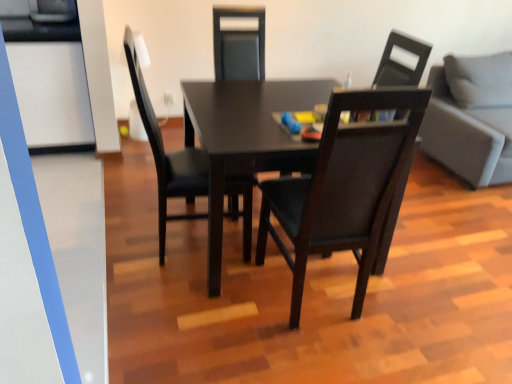
Find the location of `matte black chair at center, the third chair when ordered from left to right`. matte black chair at center, the third chair when ordered from left to right is located at coordinates (399, 63).

Describe the element at coordinates (167, 154) in the screenshot. I see `matte black chair at center, arranged as the first chair when viewed from the left` at that location.

This screenshot has height=384, width=512. What do you see at coordinates (343, 188) in the screenshot?
I see `matte black chair at center, which appears as the 2th chair when viewed from the right` at bounding box center [343, 188].

In order to click on gray fabric couch at right in this screenshot , I will do `click(471, 118)`.

Does gray fabric couch at right have a smaller size compared to matte black table at center?

No.

Image resolution: width=512 pixels, height=384 pixels. What are the coordinates of `studio couch behind the matte black table at center` in the screenshot? It's located at (471, 118).

How different are the orientations of gray fabric couch at right and matte black table at center in degrees?

gray fabric couch at right and matte black table at center are facing 90.5 degrees away from each other.

From the picture: Is gray fabric couch at right to the right of matte black table at center from the viewer's perspective?

Correct, you'll find gray fabric couch at right to the right of matte black table at center.

From a real-world perspective, is gray fabric couch at right under matte black chair at center, the third chair when ordered from left to right?

Yes, from a real-world perspective, gray fabric couch at right is below matte black chair at center, the third chair when ordered from left to right.

Could you measure the distance between gray fabric couch at right and matte black chair at center, the first chair in the right-to-left sequence?

gray fabric couch at right and matte black chair at center, the first chair in the right-to-left sequence, are 33.77 inches apart from each other.

Between gray fabric couch at right and matte black chair at center, the third chair when ordered from left to right, which one has larger size?

With larger size is gray fabric couch at right.

Between gray fabric couch at right and matte black chair at center, the first chair in the right-to-left sequence, which one appears on the right side from the viewer's perspective?

gray fabric couch at right.

Does matte black chair at center, which is the third chair from right to left, have a larger size compared to transparent glass door at left?

Indeed, matte black chair at center, which is the third chair from right to left, has a larger size compared to transparent glass door at left.

In the image, is matte black chair at center, which is the third chair from right to left, on the left side or the right side of transparent glass door at left?

Based on their positions, matte black chair at center, which is the third chair from right to left, is located to the right of transparent glass door at left.

Would you say matte black chair at center, which is the third chair from right to left, is outside transparent glass door at left?

That's correct, matte black chair at center, which is the third chair from right to left, is outside of transparent glass door at left.

In the scene shown: From a real-world perspective, is matte black chair at center, arranged as the first chair when viewed from the left, located beneath transparent glass door at left?

Indeed, from a real-world perspective, matte black chair at center, arranged as the first chair when viewed from the left, is positioned beneath transparent glass door at left.

Is matte black chair at center, the first chair in the right-to-left sequence, turned away from matte black chair at center, arranged as the first chair when viewed from the left?

matte black chair at center, the first chair in the right-to-left sequence, is not turned away from matte black chair at center, arranged as the first chair when viewed from the left.

Can you confirm if matte black chair at center, the third chair when ordered from left to right, is positioned to the right of matte black chair at center, which is the third chair from right to left?

Indeed, matte black chair at center, the third chair when ordered from left to right, is positioned on the right side of matte black chair at center, which is the third chair from right to left.

Which object is further away from the camera, matte black chair at center, the third chair when ordered from left to right, or matte black chair at center, arranged as the first chair when viewed from the left?

matte black chair at center, the third chair when ordered from left to right, is more distant.

Which is behind, point (409, 44) or point (256, 183)?

The point (409, 44) is behind.

Is the surface of gray fabric couch at right in direct contact with matte black chair at center, the 2th chair in the left-to-right sequence?

No, gray fabric couch at right is not next to matte black chair at center, the 2th chair in the left-to-right sequence.

Looking at this image, in terms of size, does gray fabric couch at right appear bigger or smaller than matte black chair at center, the 2th chair in the left-to-right sequence?

In the image, gray fabric couch at right appears to be larger than matte black chair at center, the 2th chair in the left-to-right sequence.

Considering the points (469, 135) and (302, 236), which point is in front, point (469, 135) or point (302, 236)?

The point (302, 236) is closer.

How different are the orientations of gray fabric couch at right and matte black chair at center, which appears as the 2th chair when viewed from the right, in degrees?

The angle between the facing direction of gray fabric couch at right and the facing direction of matte black chair at center, which appears as the 2th chair when viewed from the right, is 175 degrees.

Does matte black chair at center, the first chair in the right-to-left sequence, come behind matte black table at center?

Yes, it is.

From a real-world perspective, which is physically above, matte black chair at center, the third chair when ordered from left to right, or matte black table at center?

matte black chair at center, the third chair when ordered from left to right, is physically above.

Does point (383, 73) lie in front of point (222, 234)?

No, (383, 73) is further to viewer.

Considering the relative positions of matte black chair at center, the first chair in the right-to-left sequence, and matte black table at center in the image provided, is matte black chair at center, the first chair in the right-to-left sequence, to the left of matte black table at center from the viewer's perspective?

In fact, matte black chair at center, the first chair in the right-to-left sequence, is to the right of matte black table at center.

In the scene shown: From a real-world perspective, is matte black chair at center, which is the third chair from right to left, above or below matte black table at center?

Clearly, from a real-world perspective, matte black chair at center, which is the third chair from right to left, is above matte black table at center.

Which object is wider, matte black chair at center, arranged as the first chair when viewed from the left, or matte black table at center?

Wider between the two is matte black table at center.

Is matte black chair at center, which is the third chair from right to left, directly adjacent to matte black table at center?

No, matte black chair at center, which is the third chair from right to left, is not with matte black table at center.

Is matte black table at center located within matte black chair at center, arranged as the first chair when viewed from the left?

No, matte black table at center is not a part of matte black chair at center, arranged as the first chair when viewed from the left.

At what (x,y) coordinates should I click in order to perform the action: click on table directly beneath the gray fabric couch at right (from a real-world perspective). Please return your answer as a coordinate pair (x, y). This screenshot has width=512, height=384. Looking at the image, I should click on (246, 138).

You are a GUI agent. You are given a task and a screenshot of the screen. Output one action in this format:
    pyautogui.click(x=<x>, y=<y>)
    Task: Click on the chair that is the 2nd object above the gray fabric couch at right (from a real-world perspective)
    
    Given the screenshot: What is the action you would take?
    pyautogui.click(x=399, y=63)

Looking at the image, which one is located further to matte black chair at center, the 2th chair in the left-to-right sequence, gray fabric couch at right or matte black chair at center, the third chair when ordered from left to right?

gray fabric couch at right is further to matte black chair at center, the 2th chair in the left-to-right sequence.

Looking at the image, which one is located closer to matte black chair at center, which appears as the 2th chair when viewed from the right, matte black chair at center, the third chair when ordered from left to right, or gray fabric couch at right?

Among the two, matte black chair at center, the third chair when ordered from left to right, is located nearer to matte black chair at center, which appears as the 2th chair when viewed from the right.

Considering their positions, is matte black chair at center, which appears as the 2th chair when viewed from the right, positioned closer to matte black chair at center, which is the third chair from right to left, than gray fabric couch at right?

matte black chair at center, which appears as the 2th chair when viewed from the right.

Estimate the real-world distances between objects in this image. Which object is further from matte black chair at center, the third chair when ordered from left to right, transparent glass door at left or matte black table at center?

Among the two, transparent glass door at left is located further to matte black chair at center, the third chair when ordered from left to right.

From the picture: When comparing their distances from gray fabric couch at right, does matte black chair at center, arranged as the first chair when viewed from the left, or matte black table at center seem closer?

matte black table at center.

Considering their positions, is matte black chair at center, the 2th chair in the left-to-right sequence, positioned closer to transparent glass door at left than matte black table at center?

Among the two, matte black table at center is located nearer to transparent glass door at left.

From the image, which object appears to be nearer to matte black chair at center, arranged as the first chair when viewed from the left, matte black chair at center, the 2th chair in the left-to-right sequence, or matte black chair at center, the first chair in the right-to-left sequence?

matte black chair at center, the 2th chair in the left-to-right sequence, is closer to matte black chair at center, arranged as the first chair when viewed from the left.

Based on the photo, considering their positions, is matte black chair at center, which is the third chair from right to left, positioned further to gray fabric couch at right than matte black chair at center, the third chair when ordered from left to right?

Based on the image, matte black chair at center, which is the third chair from right to left, appears to be further to gray fabric couch at right.

Identify the location of table positioned between matte black chair at center, which appears as the 2th chair when viewed from the right, and matte black chair at center, the first chair in the right-to-left sequence, from near to far. This screenshot has width=512, height=384. (246, 138).

You are a GUI agent. You are given a task and a screenshot of the screen. Output one action in this format:
    pyautogui.click(x=<x>, y=<y>)
    Task: Click on the chair positioned between transparent glass door at left and matte black chair at center, which is the third chair from right to left, from near to far
    This screenshot has height=384, width=512.
    Given the screenshot: What is the action you would take?
    pyautogui.click(x=343, y=188)

Find the location of a particular element. This screenshot has height=384, width=512. chair between matte black chair at center, the 2th chair in the left-to-right sequence, and gray fabric couch at right is located at coordinates (399, 63).

The image size is (512, 384). Identify the location of chair situated between matte black chair at center, which is the third chair from right to left, and matte black chair at center, the first chair in the right-to-left sequence, from left to right. (343, 188).